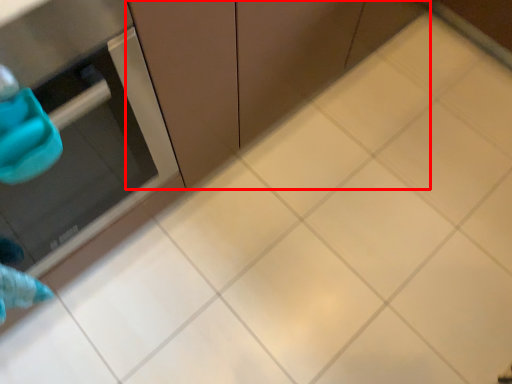
Question: From the image's perspective, where is cabinetry (annotated by the red box) located relative to appliance?

Choices:
 (A) below
 (B) above

Answer: (B)